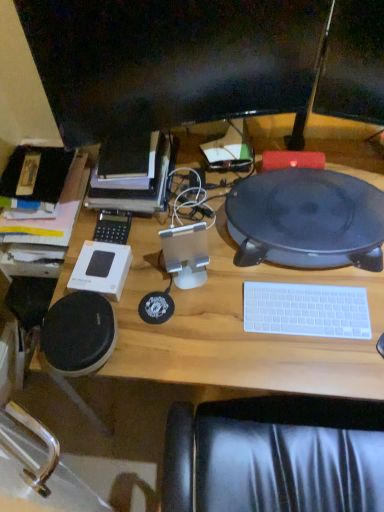
Locate an element on the screen. This screenshot has width=384, height=512. free area behind white plastic keyboard at lower right is located at coordinates (281, 269).